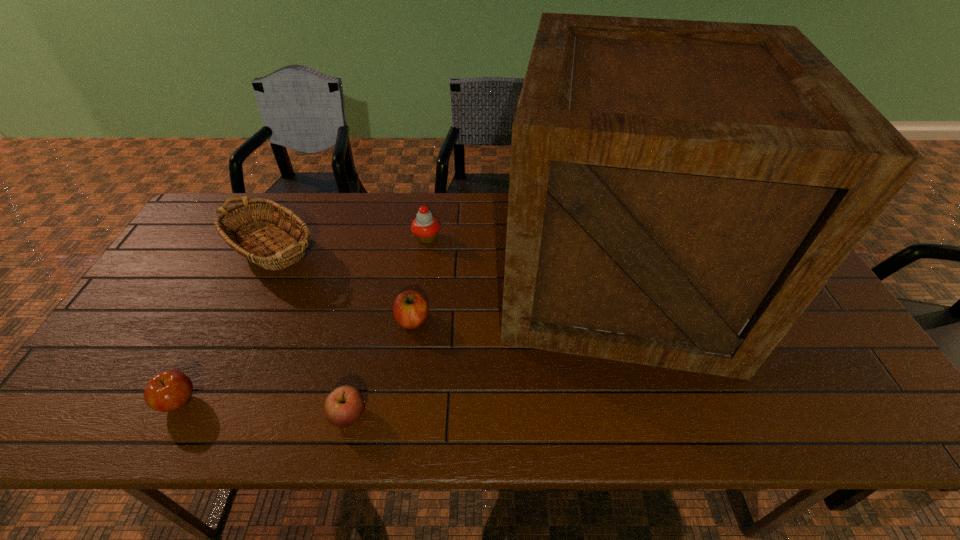
The image size is (960, 540). I want to click on box, so click(x=680, y=191).

You are a GUI agent. You are given a task and a screenshot of the screen. Output one action in this format:
    pyautogui.click(x=<x>, y=<y>)
    Task: Click on the tallest object
    This screenshot has height=540, width=960.
    Given the screenshot: What is the action you would take?
    pyautogui.click(x=680, y=191)

Locate an element on the screen. Image resolution: width=960 pixels, height=540 pixels. the second tallest object is located at coordinates (239, 236).

Locate an element on the screen. the third tallest object is located at coordinates (425, 227).

Identify the location of the farthest apple. Image resolution: width=960 pixels, height=540 pixels. (410, 309).

Locate an element on the screen. The image size is (960, 540). the leftmost apple is located at coordinates (170, 390).

Where is `the fourth object from right to left`? The height and width of the screenshot is (540, 960). the fourth object from right to left is located at coordinates (345, 405).

Where is `vacant space situated 0.110m on the front of the rightmost object`? This screenshot has height=540, width=960. vacant space situated 0.110m on the front of the rightmost object is located at coordinates (661, 425).

Where is `blank space located on the right of the second tallest object`? This screenshot has width=960, height=540. blank space located on the right of the second tallest object is located at coordinates (437, 259).

Find the location of a particular element. Image resolution: width=960 pixels, height=540 pixels. vacant space situated 0.260m on the right of the fourth shortest object is located at coordinates (524, 238).